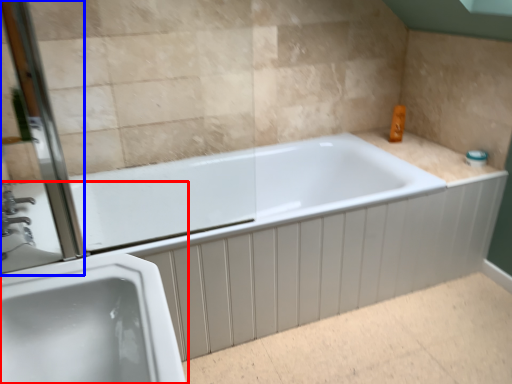
Question: Which point is closer to the camera, sink (highlighted by a red box) or screen door (highlighted by a blue box)?

Choices:
 (A) sink
 (B) screen door

Answer: (A)